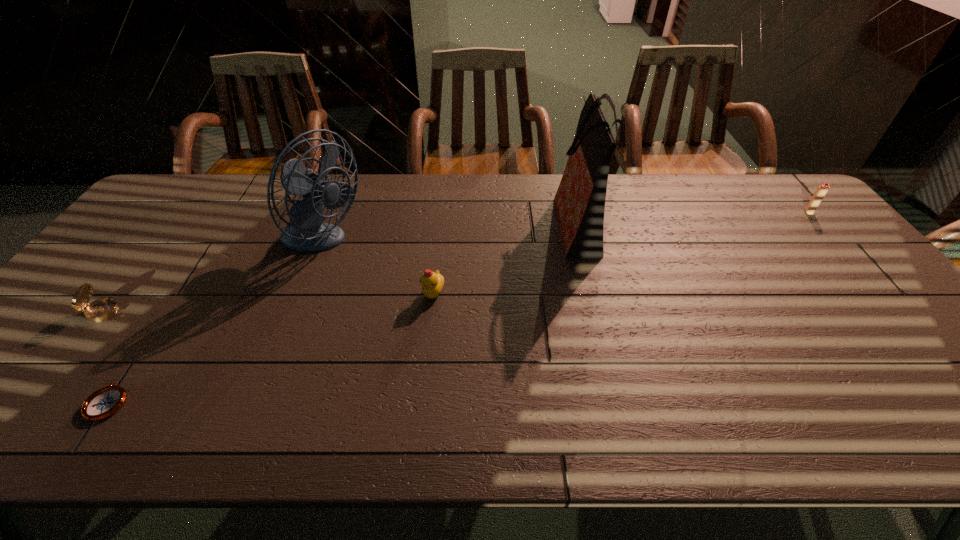
You are a GUI agent. You are given a task and a screenshot of the screen. Output one action in this format:
    pyautogui.click(x=<x>, y=<y>)
    Task: Click on the free point that satisfies the following two spatial constraints: 1. on the front side of the second object from right to left; 2. on the front-facing side of the duckling
    The width and height of the screenshot is (960, 540).
    Given the screenshot: What is the action you would take?
    pyautogui.click(x=596, y=293)

Locate an element on the screen. The height and width of the screenshot is (540, 960). vacant space that satisfies the following two spatial constraints: 1. on the back side of the rightmost object; 2. on the right side of the fifth object from right to left is located at coordinates (233, 212).

The image size is (960, 540). I want to click on free spot that satisfies the following two spatial constraints: 1. on the front side of the shopping bag; 2. on the front-facing side of the duckling, so click(596, 293).

Locate an element on the screen. Image resolution: width=960 pixels, height=540 pixels. free space that satisfies the following two spatial constraints: 1. on the front-facing side of the third object from right to left; 2. with the dial facing the left compass is located at coordinates (431, 312).

Identify the location of vacant area that satisfies the following two spatial constraints: 1. on the back side of the right compass; 2. on the right side of the igniter. (233, 212).

The image size is (960, 540). What are the coordinates of `blank space that satisfies the following two spatial constraints: 1. on the front-facing side of the duckling; 2. with the dial facing the left compass` in the screenshot? It's located at click(x=431, y=312).